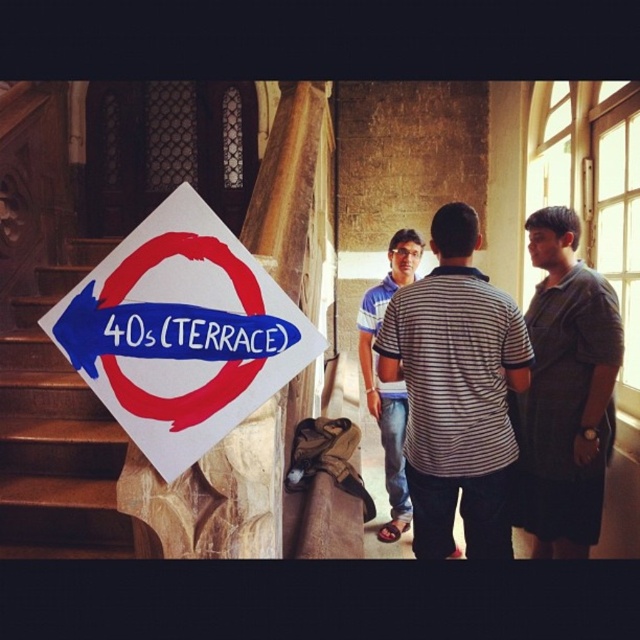
You are a photographer trying to capture a group photo of the two people wearing the striped cotton shirt at center and the dark gray striped shirt at right. If you want to ensure both are fully visible in the frame, which person should you position closer to the camera?

The striped cotton shirt at center is shorter than the dark gray striped shirt at right, so positioning the striped cotton shirt at center closer to the camera will help ensure both are fully visible in the frame.

You are standing at the bottom of the wooden stairs in the historic building. You see two points marked in the image. Which point is closer to you, point (515, 340) or point (595, 330)?

Point (515, 340) is closer to you than point (595, 330).

You are a visitor trying to locate the nearest exit. You see the white paper sign at upper left and the dark gray striped shirt at right. Which object is smaller in size?

The white paper sign at upper left is smaller than the dark gray striped shirt at right.